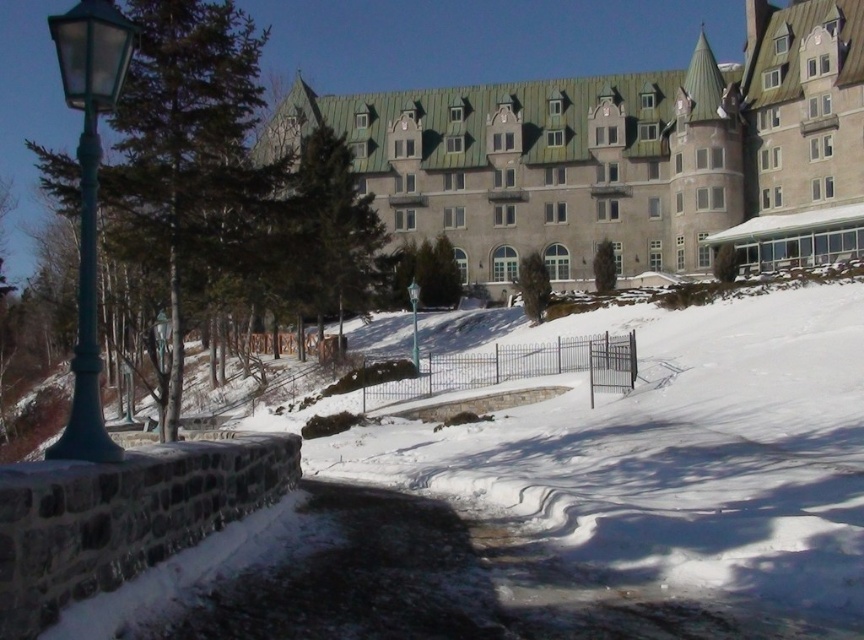
Which is in front, point (823, 193) or point (94, 156)?

Point (94, 156)

Image resolution: width=864 pixels, height=640 pixels. Identify the location of gray stone hotel at center. (621, 156).

Which is behind, point (723, 211) or point (68, 64)?

Point (723, 211)

The width and height of the screenshot is (864, 640). Find the location of `gray stone hotel at center`. gray stone hotel at center is located at coordinates (621, 156).